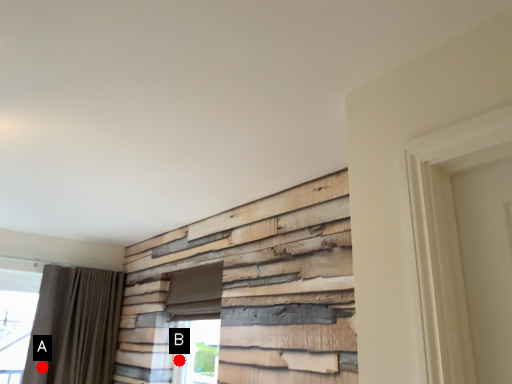
Question: Two points are circled on the image, labeled by A and B beside each circle. Among these points, which one is nearest to the camera?

Choices:
 (A) A is closer
 (B) B is closer

Answer: (B)